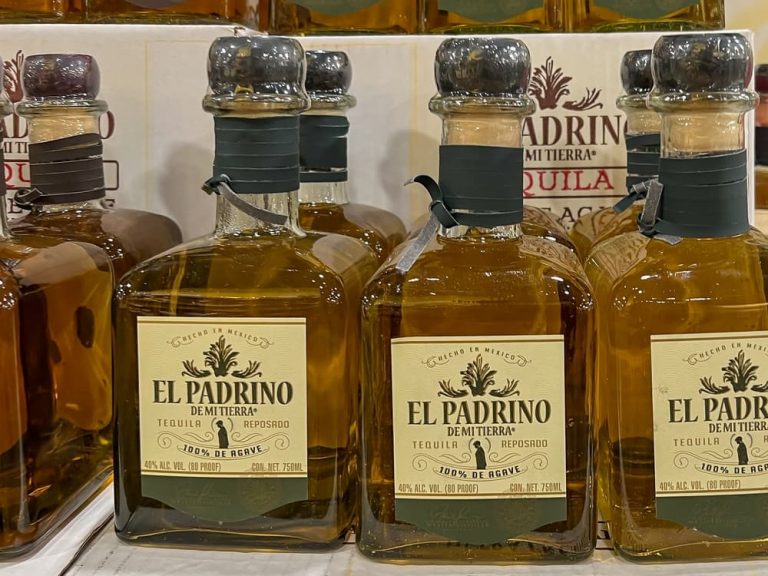
Where is `tabletop`? The height and width of the screenshot is (576, 768). tabletop is located at coordinates (179, 564).